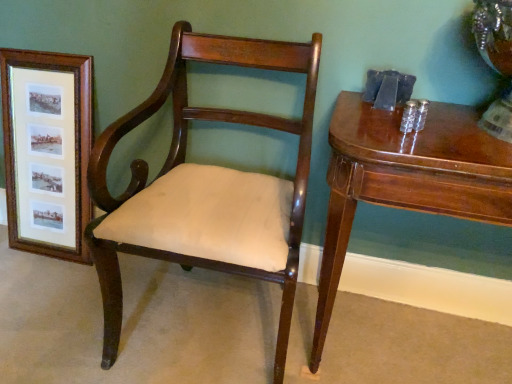
The width and height of the screenshot is (512, 384). In order to click on vacant space underneath mahogany wood chair at center (from a real-world perspective) in this screenshot , I will do `click(211, 322)`.